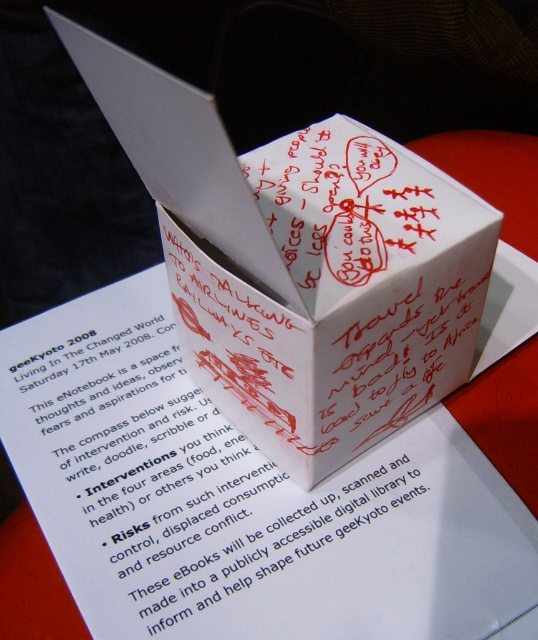
Question: Can you confirm if white paper at center is thinner than white paper cube at center?

Choices:
 (A) no
 (B) yes

Answer: (A)

Question: Does white paper at center have a smaller size compared to white paper cube at center?

Choices:
 (A) yes
 (B) no

Answer: (A)

Question: Is white paper at center above white paper cube at center?

Choices:
 (A) no
 (B) yes

Answer: (A)